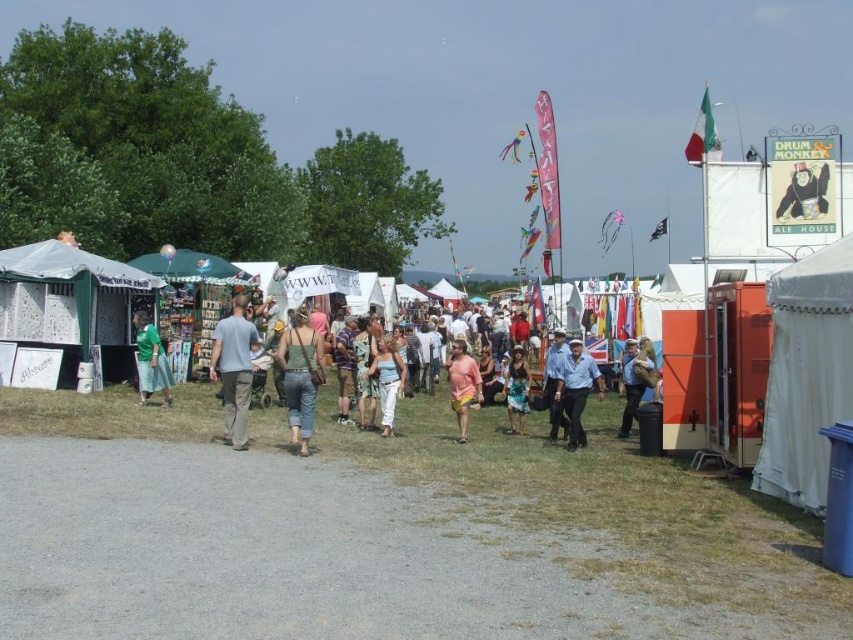
Question: Which of the following is the closest to the observer?

Choices:
 (A) (584, 365)
 (B) (466, 426)
 (C) (651, 358)
 (D) (160, 340)

Answer: (A)

Question: Estimate the real-world distances between objects in this image. Which object is farther from the gray cotton shirt at center?

Choices:
 (A) white canvas tent at right
 (B) light blue shirt at center
 (C) pink fabric dress at center

Answer: (A)

Question: Observing the image, what is the correct spatial positioning of white canvas tent at left in reference to pink fabric dress at center?

Choices:
 (A) above
 (B) below

Answer: (A)

Question: Can you confirm if green fabric skirt at left is bigger than pink fabric dress at center?

Choices:
 (A) no
 (B) yes

Answer: (A)

Question: Is white canvas tent at left to the left of green fabric tank top at center from the viewer's perspective?

Choices:
 (A) no
 (B) yes

Answer: (B)

Question: Which point is farther to the camera?

Choices:
 (A) gray cotton shirt at center
 (B) green fabric skirt at left
 (C) pink fabric dress at center
 (D) brown leather jacket at center

Answer: (B)